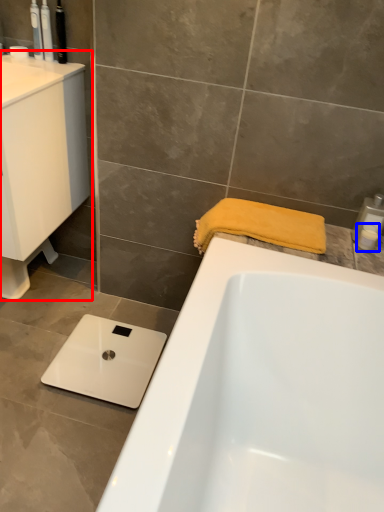
Question: Among these objects, which one is nearest to the camera, sink (highlighted by a red box) or toiletry (highlighted by a blue box)?

Choices:
 (A) sink
 (B) toiletry

Answer: (A)